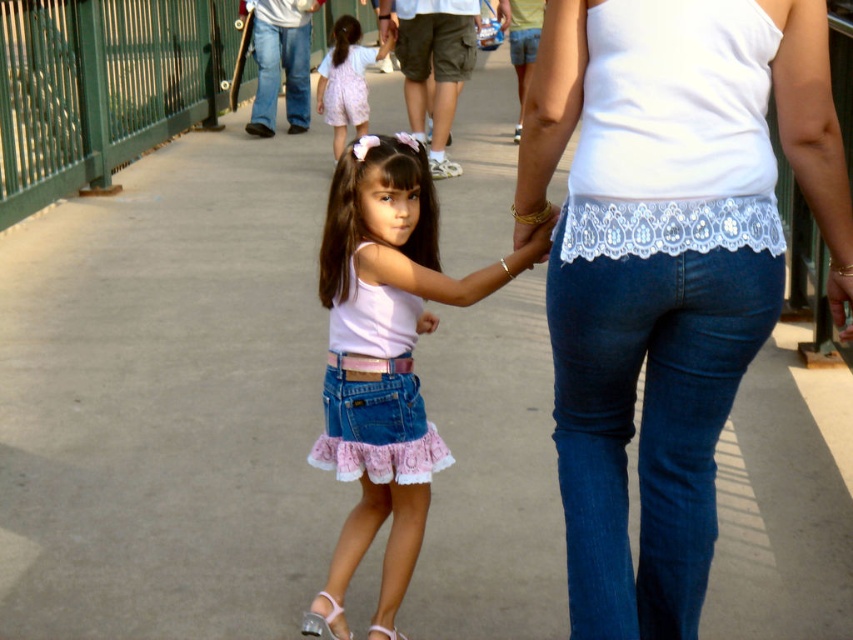
Can you confirm if pink denim skirt at center is shorter than pink lace dress at center?

In fact, pink denim skirt at center may be taller than pink lace dress at center.

Is pink denim skirt at center bigger than pink lace dress at center?

No, pink denim skirt at center is not bigger than pink lace dress at center.

Who is more forward, (332, 344) or (341, 76)?

Point (332, 344) is more forward.

This screenshot has height=640, width=853. Identify the location of pink denim skirt at center. (386, 349).

Between pink denim skirt at center and clear plastic sandal at lower center, which one is positioned higher?

pink denim skirt at center is above.

Does point (434, 266) come farther from viewer compared to point (314, 632)?

That is True.

You are a GUI agent. You are given a task and a screenshot of the screen. Output one action in this format:
    pyautogui.click(x=<x>, y=<y>)
    Task: Click on the pink denim skirt at center
    This screenshot has width=853, height=640.
    Given the screenshot: What is the action you would take?
    pyautogui.click(x=386, y=349)

Is denim jeans at center bigger than white leather sandal at lower center?

Yes.

Does denim jeans at center have a greater width compared to white leather sandal at lower center?

Yes.

Which is in front, point (627, 204) or point (393, 630)?

Point (627, 204) is more forward.

The image size is (853, 640). I want to click on denim jeans at center, so pos(666,269).